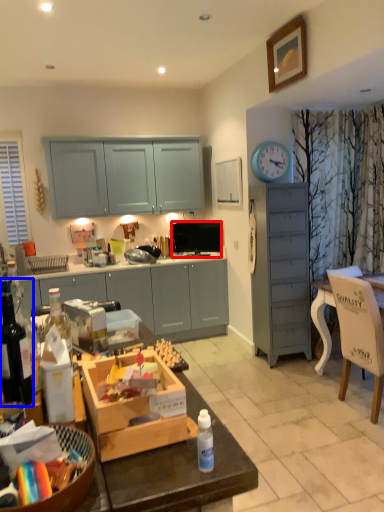
Question: Which object appears closest to the camera in this image, television (highlighted by a red box) or bottle (highlighted by a blue box)?

Choices:
 (A) television
 (B) bottle

Answer: (B)